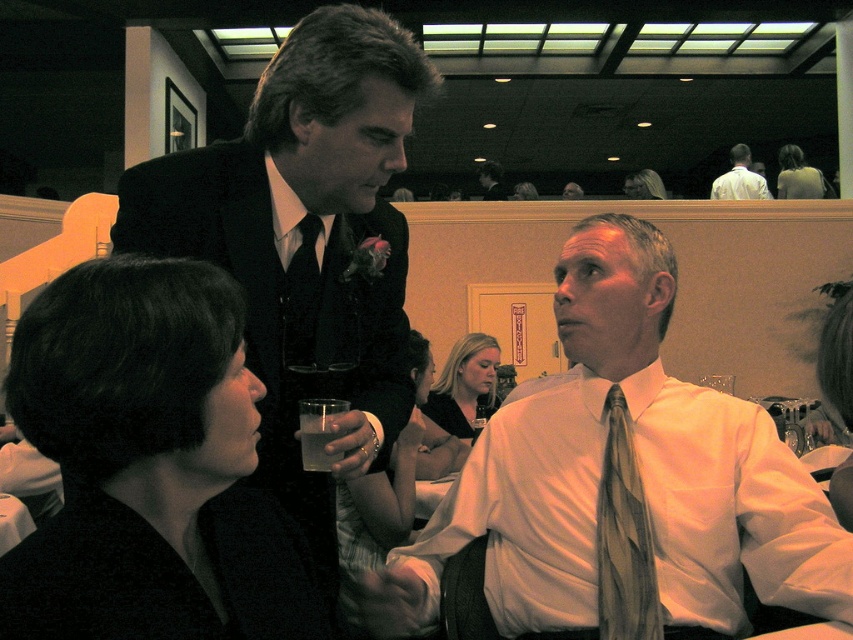
You are a photographer at the event and want to capture a candid shot of the man in the dark suit with a white shirt and black tie. However, there is a silky beige tie at center at point (624,536) in the frame. Will the silky beige tie at center block your view of the man in the dark suit with a white shirt and black tie?

Result: The silky beige tie at center is located at point (624,536), which is the center of the frame. Since the man in the dark suit with a white shirt and black tie is on the left, the silky beige tie at center will block the view of him if the camera is aimed directly at the center point.

You are a photographer at the event and need to capture both the white satin shirt at center and the white silk shirt at upper center in a single frame. Which shirt should you focus on to ensure both are visible without cropping?

You should focus on the white satin shirt at center because it occupies less space than the white silk shirt at upper center, allowing both to fit within the frame.